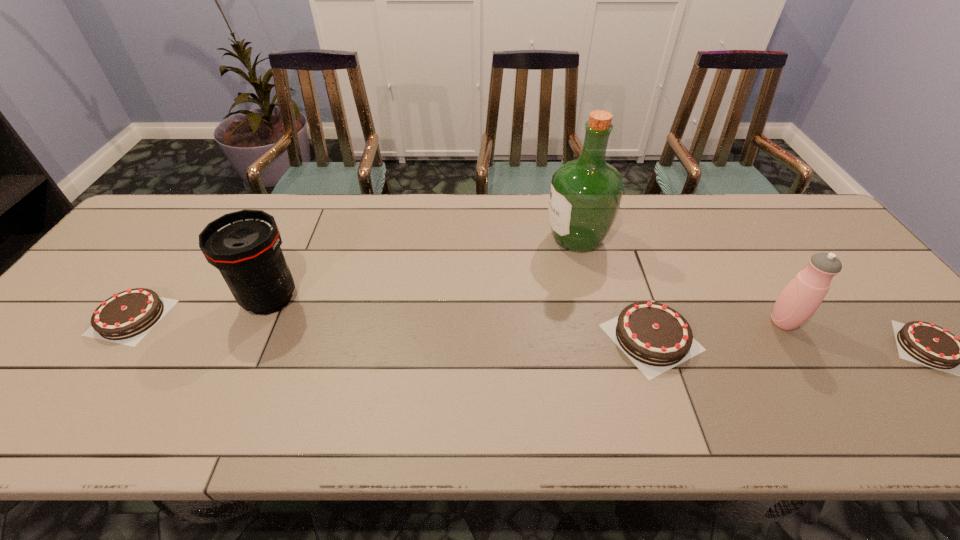
Select which object appears as the closest to the shortest object. Please provide its 2D coordinates. Your answer should be formatted as a tuple, i.e. [(x, y)], where the tuple contains the x and y coordinates of a point satisfying the conditions above.

[(801, 297)]

Locate which object ranks in proximity to the thermos bottle. Please provide its 2D coordinates. Your answer should be formatted as a tuple, i.e. [(x, y)], where the tuple contains the x and y coordinates of a point satisfying the conditions above.

[(932, 346)]

The height and width of the screenshot is (540, 960). I want to click on the closest chocolate cake relative to the rightmost object, so click(655, 337).

Identify the location of the second closest chocolate cake to the telephoto lens. This screenshot has width=960, height=540. (655, 337).

This screenshot has height=540, width=960. In order to click on vacant space that satisfies the following two spatial constraints: 1. on the front side of the second shortest object; 2. on the left side of the second object from right to left in this screenshot , I will do `click(129, 322)`.

Identify the location of free space that satisfies the following two spatial constraints: 1. on the front-facing side of the tallest object; 2. on the left side of the second chocolate cake from right to left. This screenshot has height=540, width=960. (600, 337).

At what (x,y) coordinates should I click in order to perform the action: click on free spot that satisfies the following two spatial constraints: 1. on the front-facing side of the second chocolate cake from left to right; 2. on the left side of the liquor. Please return your answer as a coordinate pair (x, y). The width and height of the screenshot is (960, 540). Looking at the image, I should click on (600, 337).

The image size is (960, 540). I want to click on free space that satisfies the following two spatial constraints: 1. on the front side of the second shortest object; 2. on the left side of the thermos bottle, so click(x=129, y=322).